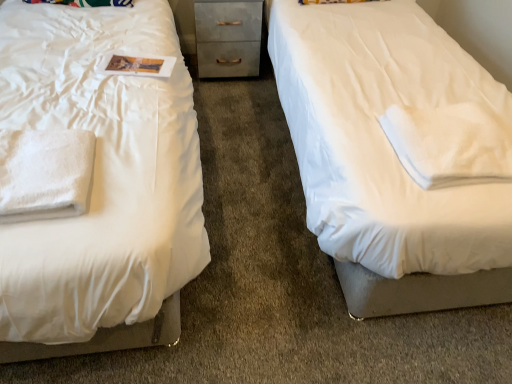
Question: In the image, is white soft cloth at right, which is the second cloth in left-to-right order, on the left side or the right side of metallic gray chest of drawers at center?

Choices:
 (A) right
 (B) left

Answer: (A)

Question: In terms of size, does white soft cloth at right, which is the second cloth in left-to-right order, appear bigger or smaller than metallic gray chest of drawers at center?

Choices:
 (A) big
 (B) small

Answer: (B)

Question: Estimate the real-world distances between objects in this image. Which object is farther from the white soft cloth at right, arranged as the first cloth when viewed from the right?

Choices:
 (A) white soft towel at left, marked as the 1th cloth in a left-to-right arrangement
 (B) metallic gray chest of drawers at center

Answer: (B)

Question: Based on their relative distances, which object is farther from the metallic gray chest of drawers at center?

Choices:
 (A) white soft cloth at right, arranged as the first cloth when viewed from the right
 (B) white soft towel at left, marked as the 1th cloth in a left-to-right arrangement

Answer: (A)